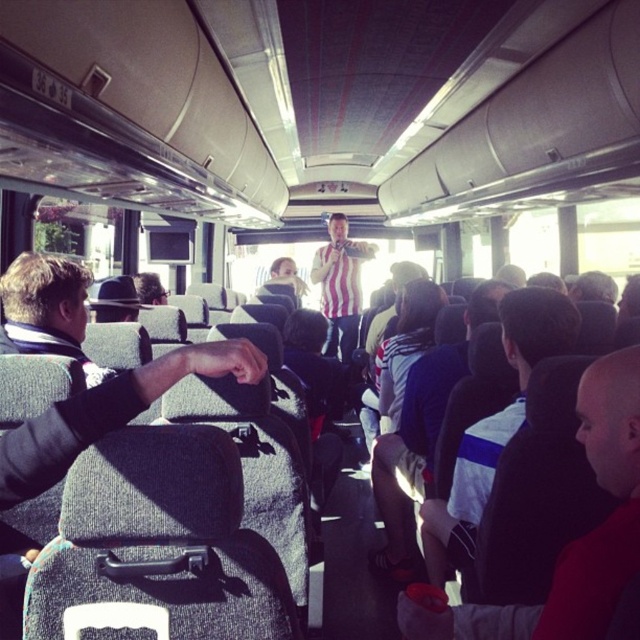
How far apart are dark gray fabric jacket at left and striped shirt at center?

4.58 meters

Is dark gray fabric jacket at left taller than striped shirt at center?

In fact, dark gray fabric jacket at left may be shorter than striped shirt at center.

Is point (4, 305) positioned in front of point (339, 337)?

Yes.

I want to click on dark gray fabric jacket at left, so click(x=49, y=308).